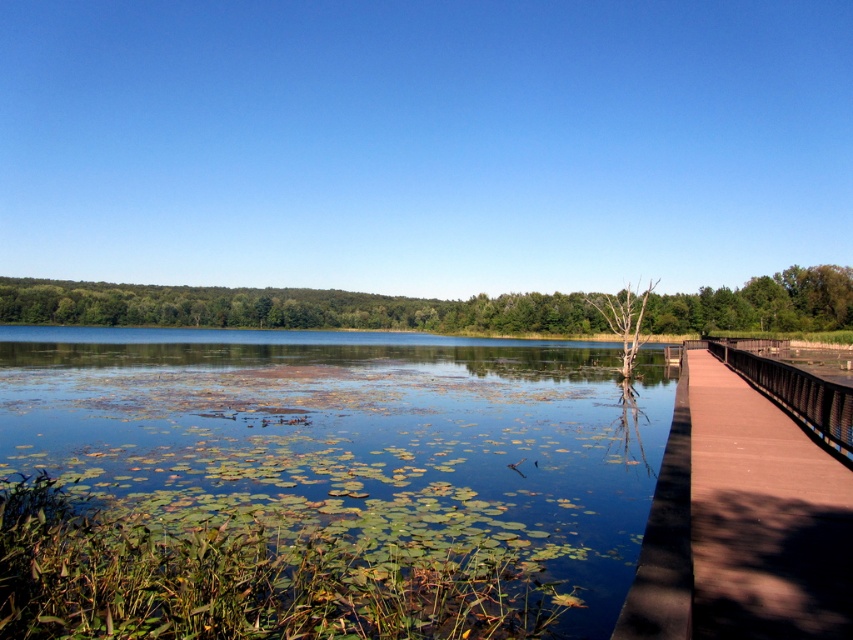
Does brown wooden bridge at right have a lesser width compared to green leafy tree at center?

Yes, brown wooden bridge at right is thinner than green leafy tree at center.

Who is taller, brown wooden bridge at right or green leafy tree at center?

green leafy tree at center is taller.

I want to click on brown wooden bridge at right, so click(763, 516).

Where is `brown wooden bridge at right`? The image size is (853, 640). brown wooden bridge at right is located at coordinates (763, 516).

Can you confirm if green leafy water at center is shorter than brown wooden bridge at right?

No, green leafy water at center is not shorter than brown wooden bridge at right.

Between point (83, 356) and point (840, 483), which one is positioned in front?

Point (840, 483)

The height and width of the screenshot is (640, 853). Identify the location of green leafy water at center. (355, 440).

Where is `green leafy water at center`? The width and height of the screenshot is (853, 640). green leafy water at center is located at coordinates (355, 440).

Can you confirm if green leafy water at center is taller than green leafy tree at center?

In fact, green leafy water at center may be shorter than green leafy tree at center.

Which is in front, point (587, 433) or point (788, 282)?

Point (587, 433) is in front.

Where is `green leafy water at center`? green leafy water at center is located at coordinates (355, 440).